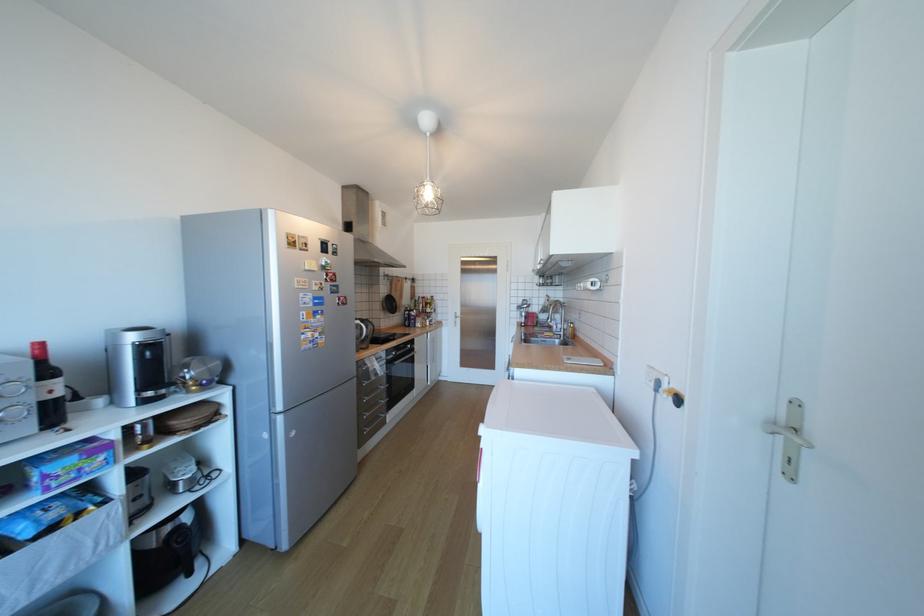
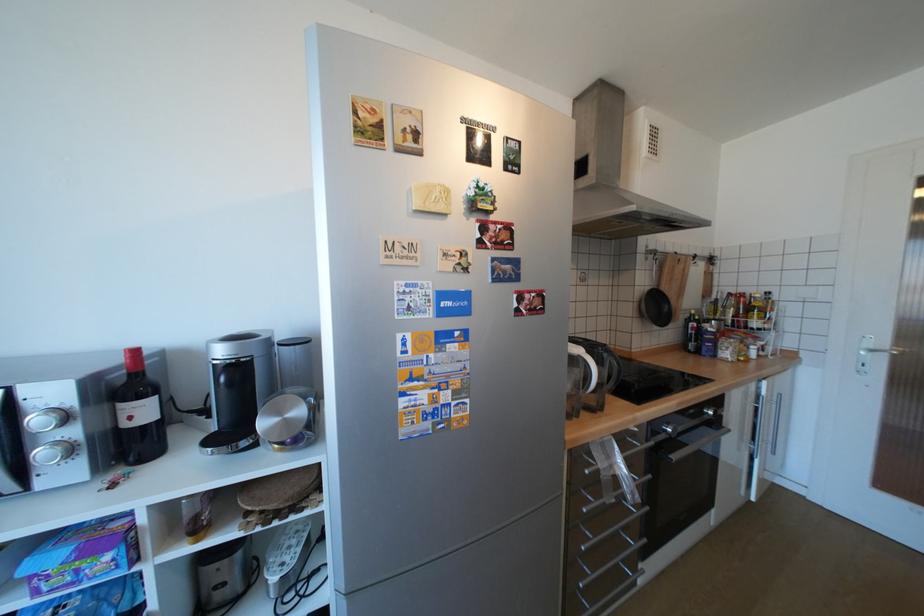
The point at (x=203, y=387) is marked in the first image. Where is the corresponding point in the second image?

(286, 446)